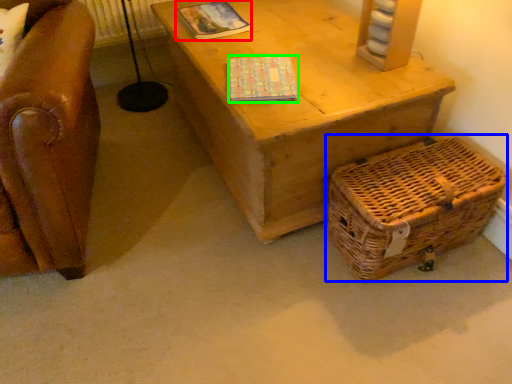
Question: Which object is the farthest from magazine (highlighted by a red box)? Choose among these: basket (highlighted by a blue box) or magazine (highlighted by a green box).

Choices:
 (A) basket
 (B) magazine

Answer: (A)